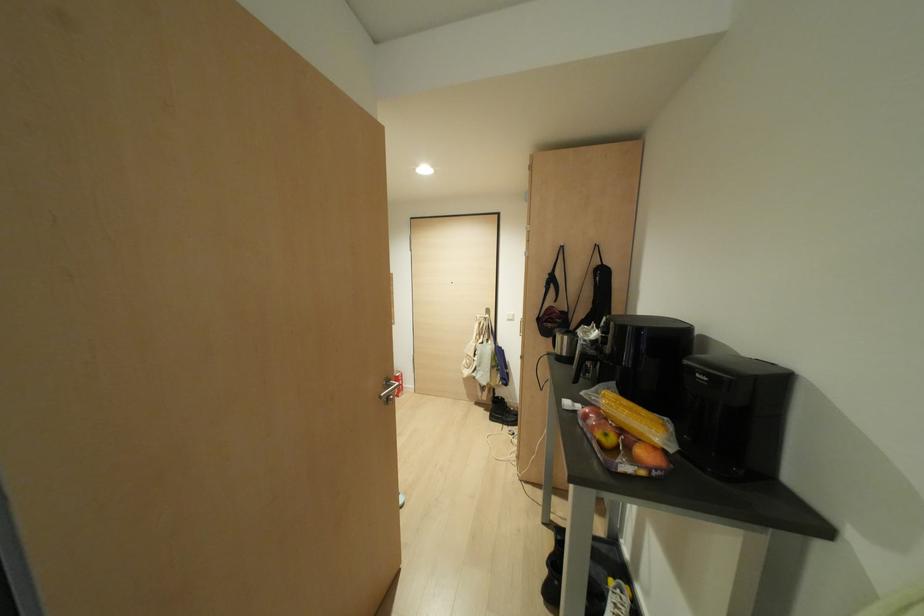
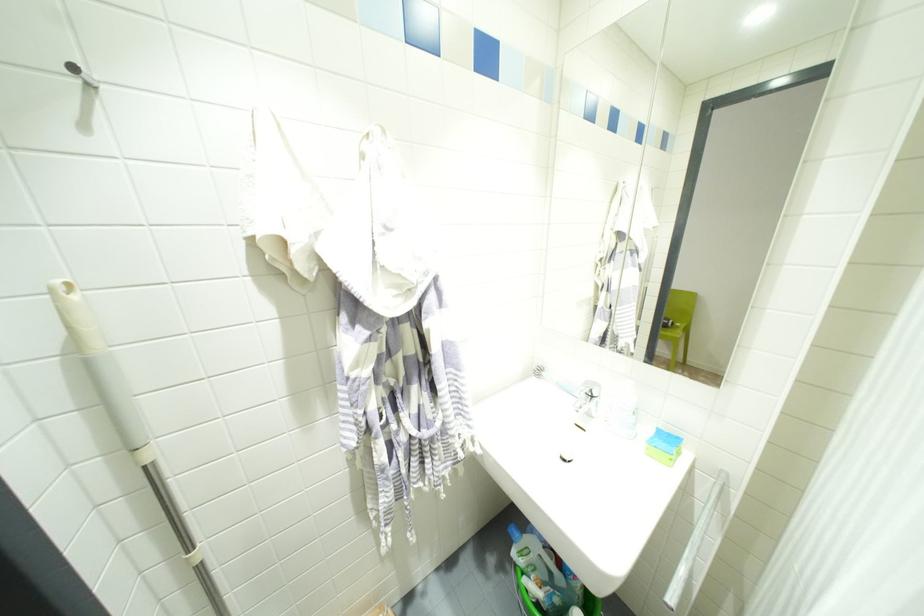
Question: I am providing you with two images of the same scene from different viewpoints. Which of the following objects are not visible in image2?

Choices:
 (A) faucet handle
 (B) silver door handle
 (C) metal wall hook
 (D) black machine handlebar

Answer: (B)